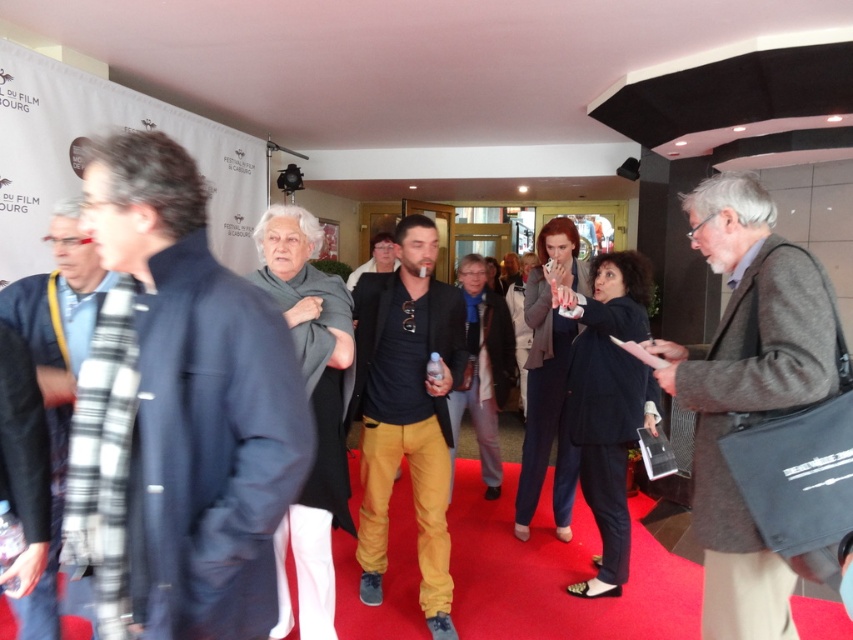
Question: Is gray wool coat at right thinner than black leather jacket at center?

Choices:
 (A) no
 (B) yes

Answer: (B)

Question: Among these points, which one is farthest from the camera?

Choices:
 (A) (152, 147)
 (B) (793, 314)
 (C) (392, 252)

Answer: (C)

Question: Is plaid scarf at left above black leather jacket at center?

Choices:
 (A) yes
 (B) no

Answer: (B)

Question: Is gray wool coat at right behind plaid scarf at left?

Choices:
 (A) yes
 (B) no

Answer: (A)

Question: Which object is closer to the camera taking this photo?

Choices:
 (A) plaid scarf at left
 (B) gray wool coat at right

Answer: (A)

Question: Among these points, which one is farthest from the camera?

Choices:
 (A) (194, 561)
 (B) (447, 602)
 (C) (769, 401)

Answer: (B)